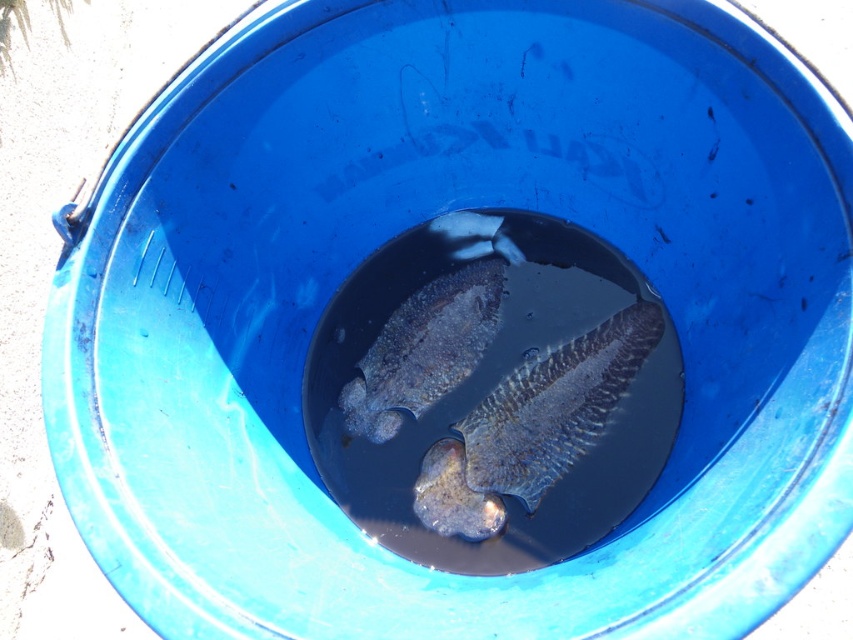
You are a fisherman who just caught two fish in a blue plastic bucket. You notice that one of them is a dark gray textured fish at center and the other is a smooth grayish fish at center. Which fish is positioned lower in the water?

The dark gray textured fish at center is located below the smooth grayish fish at center, so it is positioned lower in the water.